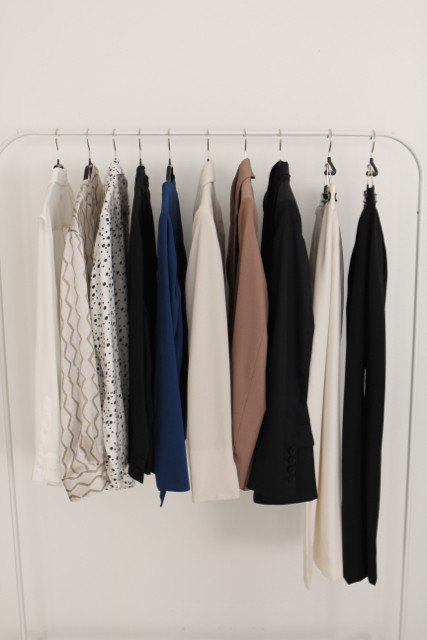
This screenshot has height=640, width=427. In order to click on clothes on hangers in this screenshot , I will do `click(361, 269)`, `click(332, 273)`, `click(293, 273)`, `click(255, 273)`, `click(206, 272)`, `click(167, 273)`, `click(143, 273)`, `click(112, 273)`, `click(73, 271)`, `click(49, 275)`.